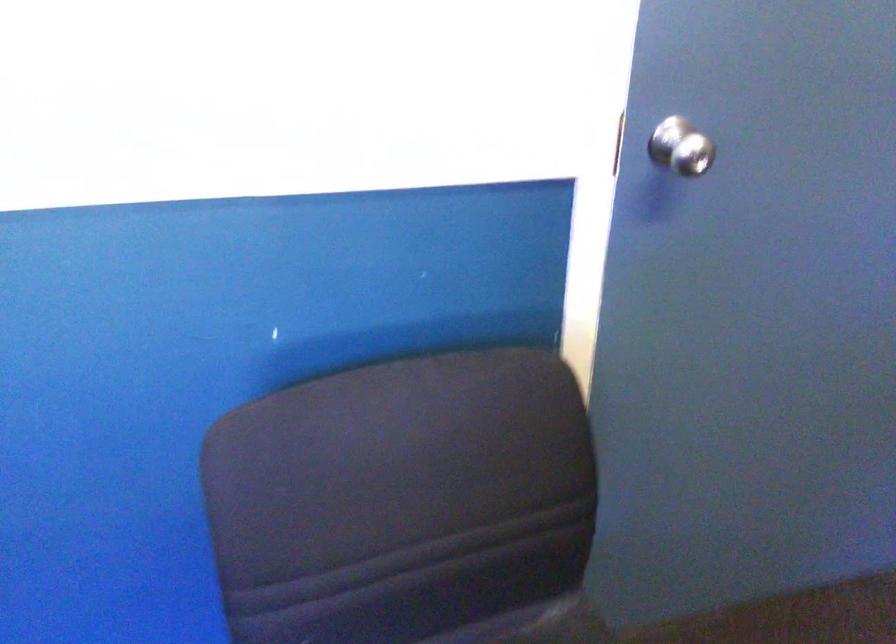
The height and width of the screenshot is (644, 896). What do you see at coordinates (681, 147) in the screenshot?
I see `a metal door knob` at bounding box center [681, 147].